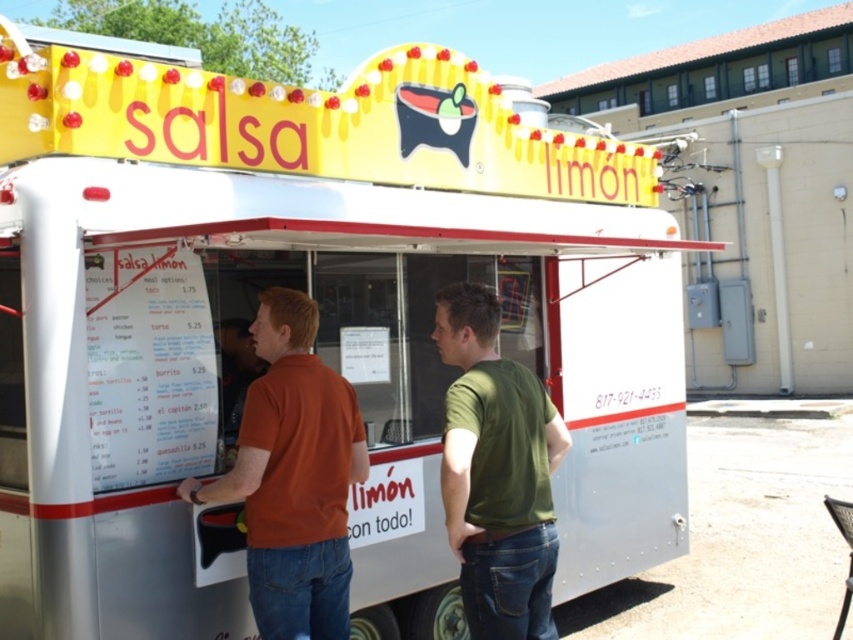
You are a customer at the food truck scene. You notice two people wearing shirts of different colors and materials. The orange cotton shirt at center and the green matte shirt at center. Which shirt is larger in size?

The orange cotton shirt at center is bigger than the green matte shirt at center.